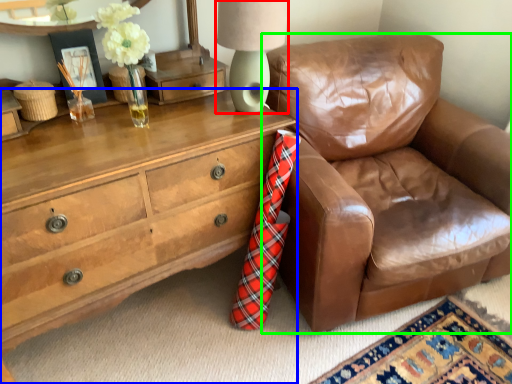
Question: Which object is the closest to the table lamp (highlighted by a red box)? Choose among these: chest of drawers (highlighted by a blue box) or chair (highlighted by a green box).

Choices:
 (A) chest of drawers
 (B) chair

Answer: (A)